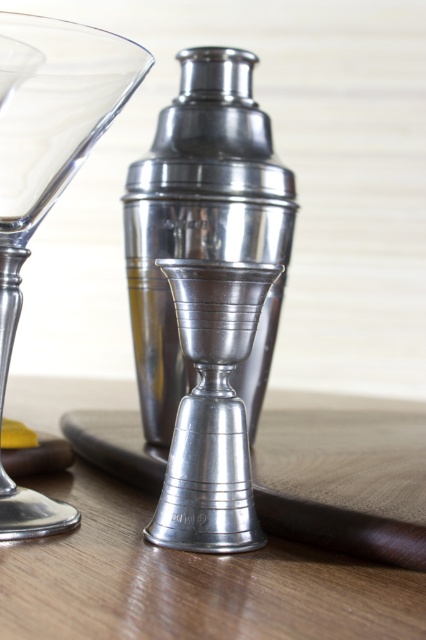
You are a bartender preparing a cocktail and need to place the metallic silver cup at lower center on the tray. Based on its coordinates, where exactly should you position it?

The metallic silver cup at lower center should be positioned at coordinates point (187, 580) on the tray as specified.

You are a bartender preparing a drink. You need to pour liquid from the metallic silver cup at lower center into the clear glass wine glass at left. Which object should you pick up first to start pouring?

You should pick up the metallic silver cup at lower center first because it is closer to the viewer, allowing easier access to begin pouring the liquid into the clear glass wine glass at left.

Consider the image. You are a bartender preparing a drink. You have a metallic silver cup at lower center and a clear glass wine glass at left. Which of these two items has a wider opening?

The metallic silver cup at lower center has a wider opening than the clear glass wine glass at left according to the description.